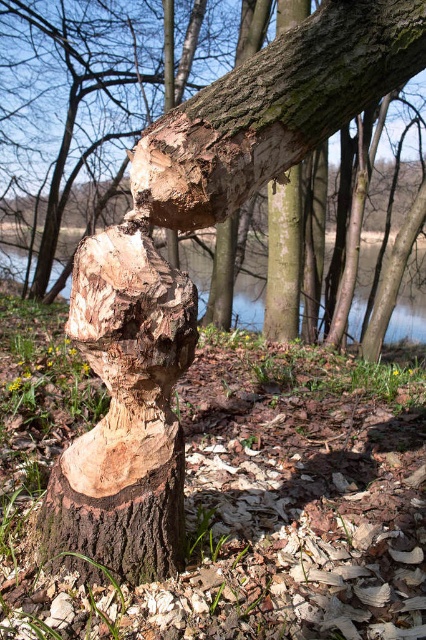
Question: Which point is closer to the camera taking this photo?

Choices:
 (A) (115, 531)
 (B) (131, 170)

Answer: (A)

Question: Observing the image, what is the correct spatial positioning of smooth brown wood at center in reference to transparent water at center?

Choices:
 (A) left
 (B) right

Answer: (A)

Question: Which of the following is the farthest from the observer?

Choices:
 (A) smooth brown wood at center
 (B) transparent water at center

Answer: (B)

Question: Can you confirm if smooth brown wood at center is positioned above transparent water at center?

Choices:
 (A) no
 (B) yes

Answer: (B)

Question: From the image, what is the correct spatial relationship of smooth brown wood at center in relation to transparent water at center?

Choices:
 (A) below
 (B) above

Answer: (B)

Question: Which object is farther from the camera taking this photo?

Choices:
 (A) natural wood tree stump at center
 (B) transparent water at center

Answer: (B)